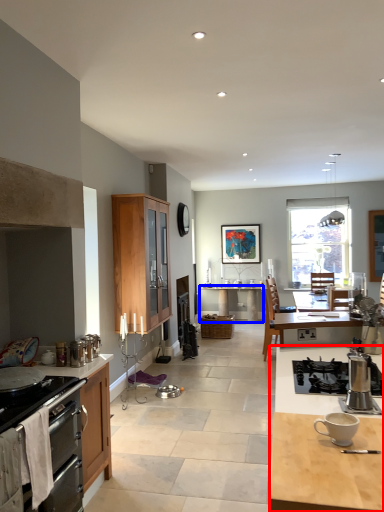
Question: Which of the following is the closest to the observer, desk (highlighted by a red box) or desk (highlighted by a blue box)?

Choices:
 (A) desk
 (B) desk

Answer: (A)